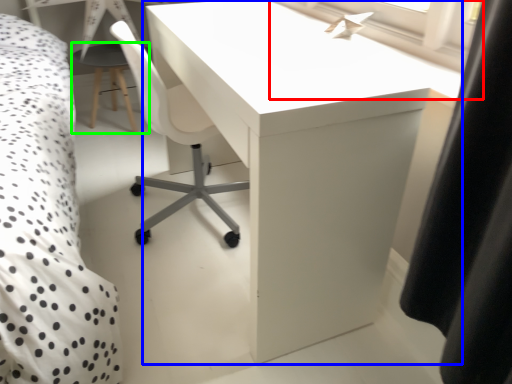
Question: Which is farther away from window screen (highlighted by a red box)? table (highlighted by a blue box) or side table (highlighted by a green box)?

Choices:
 (A) table
 (B) side table

Answer: (B)